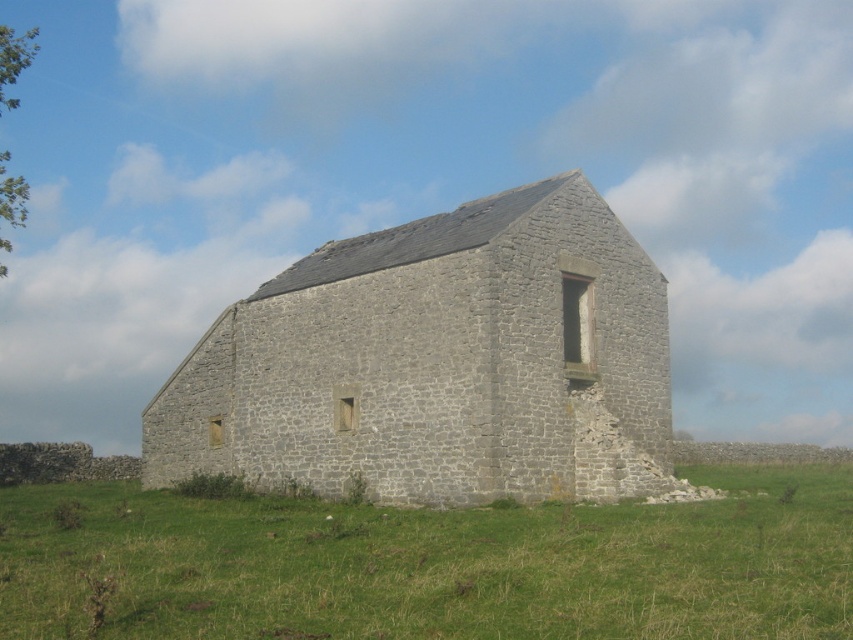
Question: Is gray stone church at center thinner than green grass at lower center?

Choices:
 (A) no
 (B) yes

Answer: (B)

Question: Is gray stone church at center closer to camera compared to green grass at lower center?

Choices:
 (A) yes
 (B) no

Answer: (B)

Question: Which point appears farthest from the camera in this image?

Choices:
 (A) (486, 212)
 (B) (137, 509)

Answer: (A)

Question: Is gray stone church at center to the right of green grass at lower center from the viewer's perspective?

Choices:
 (A) no
 (B) yes

Answer: (A)